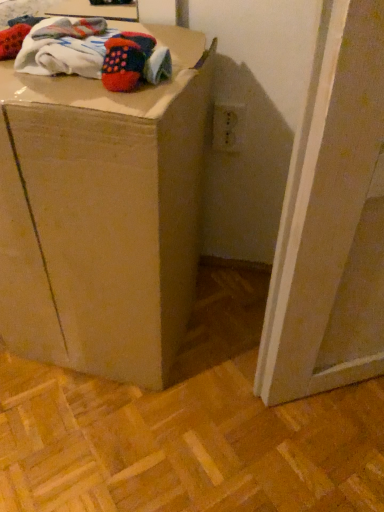
This screenshot has height=512, width=384. I want to click on free space in front of knitted wool socks at upper left, so click(68, 93).